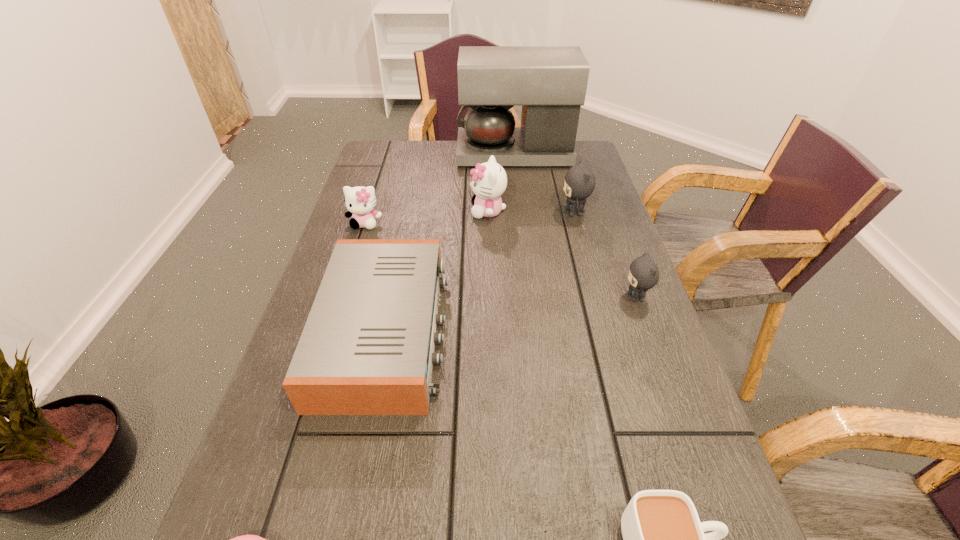
Identify which kitten is the second nearest to the radio receiver. Please provide its 2D coordinates. Your answer should be formatted as a tuple, i.e. [(x, y)], where the tuple contains the x and y coordinates of a point satisfying the conditions above.

[(489, 180)]

Image resolution: width=960 pixels, height=540 pixels. I want to click on kitten that stands as the fourth closest to the radio receiver, so click(643, 274).

Locate an element on the screen. This screenshot has height=540, width=960. free space that satisfies the following two spatial constraints: 1. on the front-facing side of the bigger white kitten; 2. on the front-facing side of the left white kitten is located at coordinates (489, 224).

Find the location of a particular element. The image size is (960, 540). free spot that satisfies the following two spatial constraints: 1. on the carafe side of the tallest object; 2. on the front-facing side of the left white kitten is located at coordinates (523, 224).